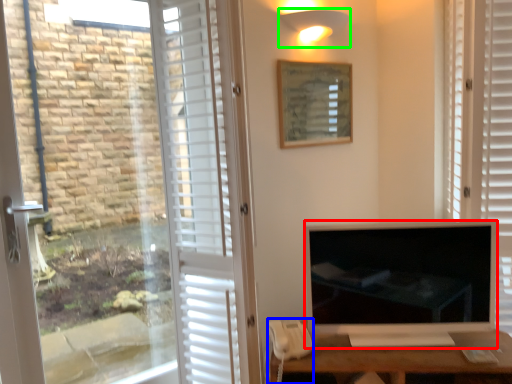
Question: Based on their relative distances, which object is nearer to television (highlighted by a red box)? Choose from corded phone (highlighted by a blue box) and light fixture (highlighted by a green box).

Choices:
 (A) corded phone
 (B) light fixture

Answer: (A)